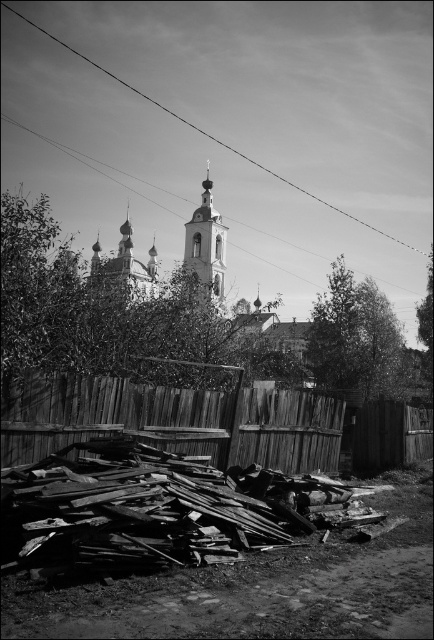
Can you confirm if smooth stone tower at center is shorter than metallic wire at upper center?

Yes.

Between smooth stone tower at center and metallic wire at upper center, which one has more height?

metallic wire at upper center is taller.

Which is in front, point (197, 269) or point (240, 156)?

Positioned in front is point (197, 269).

Where is `smooth stone tower at center`? This screenshot has height=640, width=434. smooth stone tower at center is located at coordinates (207, 244).

Does wooden fence at lower center lie in front of metallic wire at upper center?

That is True.

Is point (62, 401) farther from viewer compared to point (45, 29)?

That is False.

Between point (292, 396) and point (163, 109), which one is positioned behind?

Positioned behind is point (163, 109).

This screenshot has height=640, width=434. What are the coordinates of `wooden fence at lower center` in the screenshot? It's located at (211, 422).

Which is below, rusty wood debris at lower center or smooth stone tower at center?

rusty wood debris at lower center is lower down.

Who is taller, rusty wood debris at lower center or smooth stone tower at center?

smooth stone tower at center

Does point (89, 520) come closer to viewer compared to point (200, 228)?

Yes, it is.

Find the location of a particular element. The width and height of the screenshot is (434, 640). rusty wood debris at lower center is located at coordinates (161, 509).